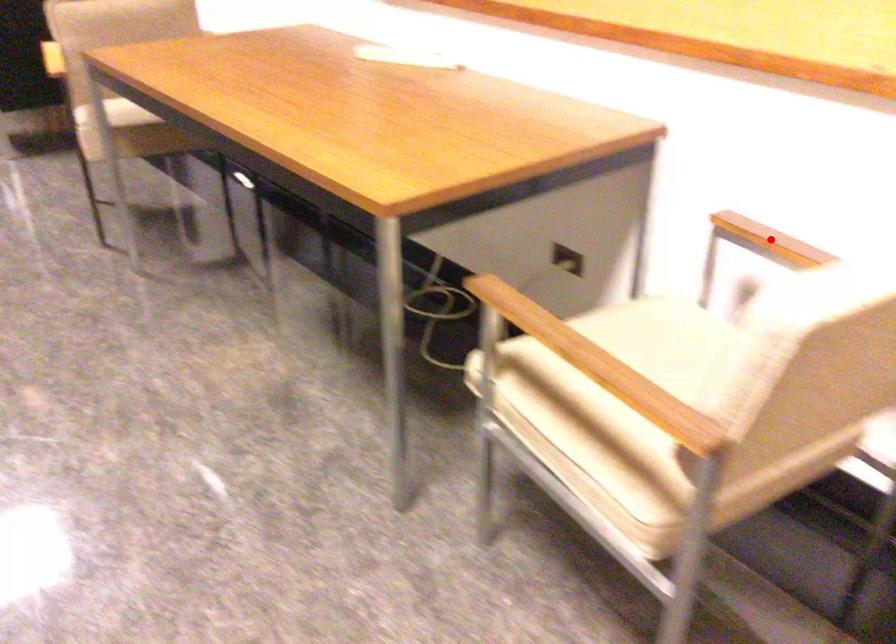
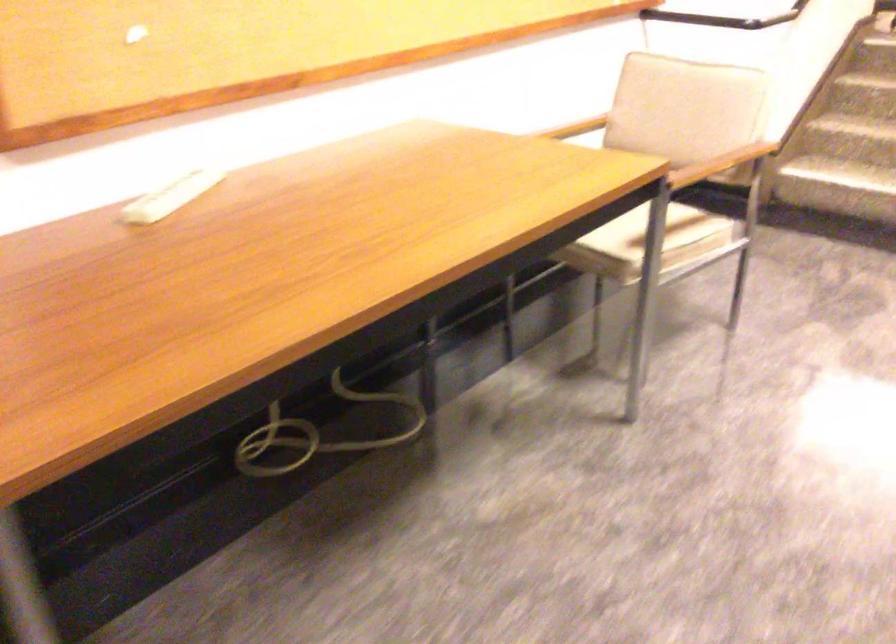
Question: I am providing you with two images of the same scene from different viewpoints. A red point is marked on the first image. Is the red point's position out of view in image 2?

Choices:
 (A) Yes
 (B) No

Answer: (A)